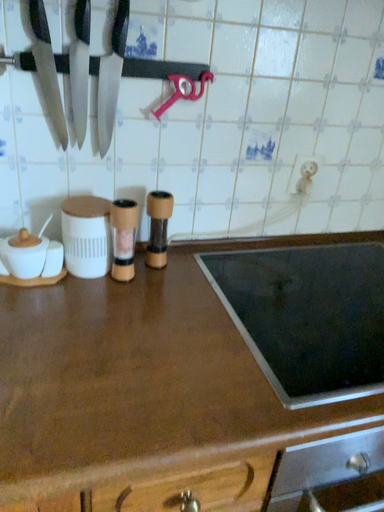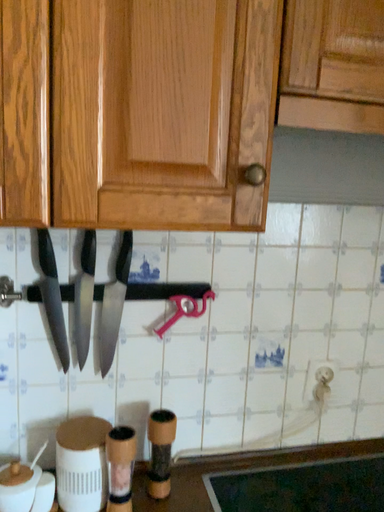
Question: How did the camera likely rotate when shooting the video?

Choices:
 (A) rotated downward
 (B) rotated upward

Answer: (B)